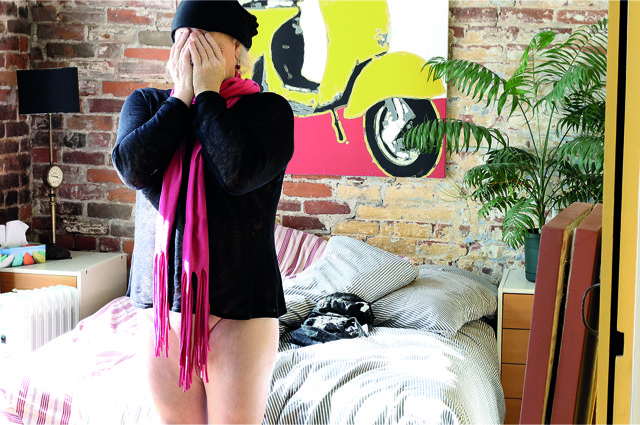
Where is `tissue`? The height and width of the screenshot is (425, 640). tissue is located at coordinates (10, 235).